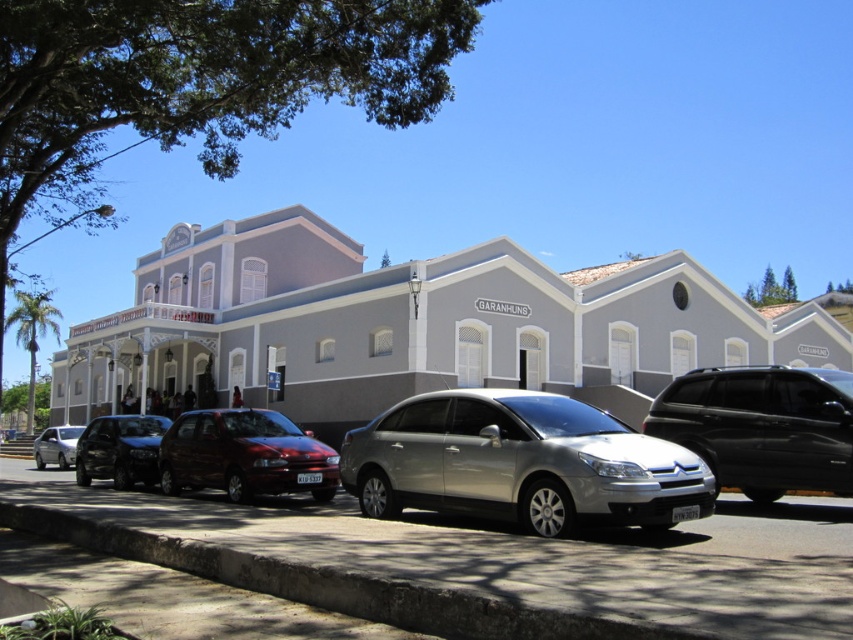
Is satin silver sedan at center thinner than matte silver sedan at lower left?

Yes.

Can you confirm if satin silver sedan at center is positioned to the left of matte silver sedan at lower left?

No, satin silver sedan at center is not to the left of matte silver sedan at lower left.

Is point (527, 490) closer to viewer compared to point (62, 442)?

That is True.

Identify the location of satin silver sedan at center. (521, 464).

Which is below, white painted building at center or matte silver sedan at lower left?

matte silver sedan at lower left

Between point (548, 362) and point (73, 448), which one is positioned behind?

Positioned behind is point (548, 362).

Between point (590, 317) and point (45, 449), which one is positioned behind?

Positioned behind is point (590, 317).

Locate an element on the screen. The image size is (853, 640). white painted building at center is located at coordinates (410, 324).

Between point (827, 577) and point (77, 428), which one is positioned in front?

Point (827, 577) is more forward.

Who is lower down, gray concrete pavement at center or matte silver sedan at lower left?

Positioned lower is matte silver sedan at lower left.

Does point (339, 554) lie in front of point (67, 451)?

Yes, it is in front of point (67, 451).

Where is `gray concrete pavement at center`? This screenshot has width=853, height=640. gray concrete pavement at center is located at coordinates (526, 554).